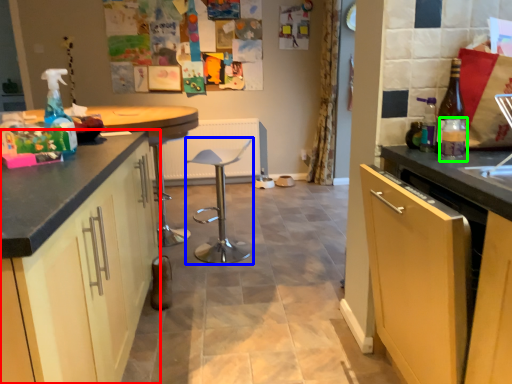
Question: Which object is positioned farthest from cabinetry (highlighted by a red box)? Select from bar stool (highlighted by a blue box) and bottle (highlighted by a green box).

Choices:
 (A) bar stool
 (B) bottle

Answer: (A)